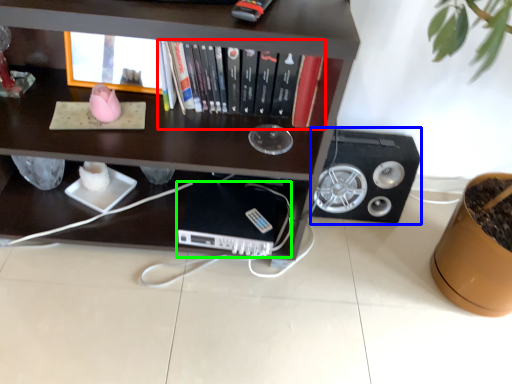
Question: Which object is the farthest from book (highlighted by a red box)? Choose among these: speaker (highlighted by a blue box) or computer (highlighted by a green box).

Choices:
 (A) speaker
 (B) computer

Answer: (A)